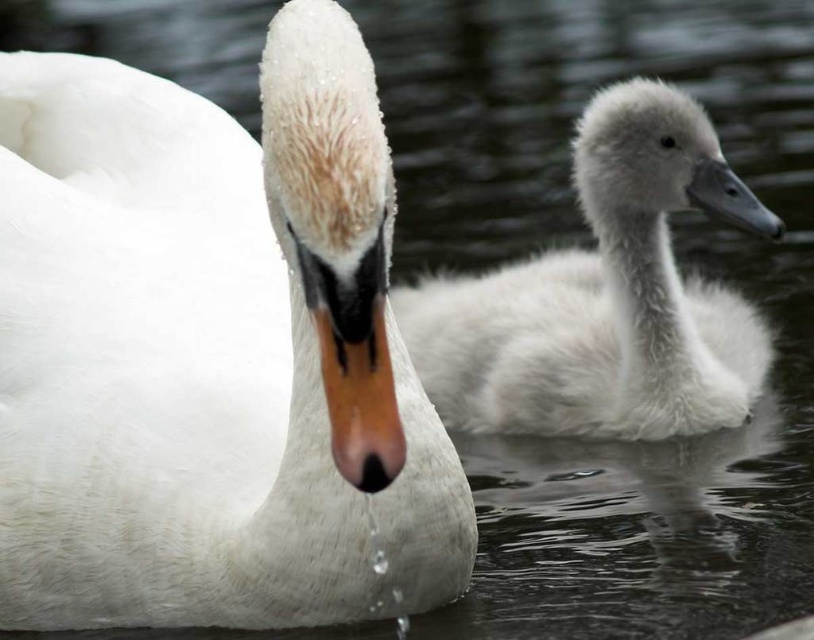
Does white fluffy swan at left have a smaller size compared to white fluffy swan at right?

No, white fluffy swan at left is not smaller than white fluffy swan at right.

Is white fluffy swan at left positioned at the back of white fluffy swan at right?

No.

Is point (460, 518) less distant than point (659, 310)?

Yes, point (460, 518) is closer to viewer.

What are the coordinates of `white fluffy swan at left` in the screenshot? It's located at (211, 353).